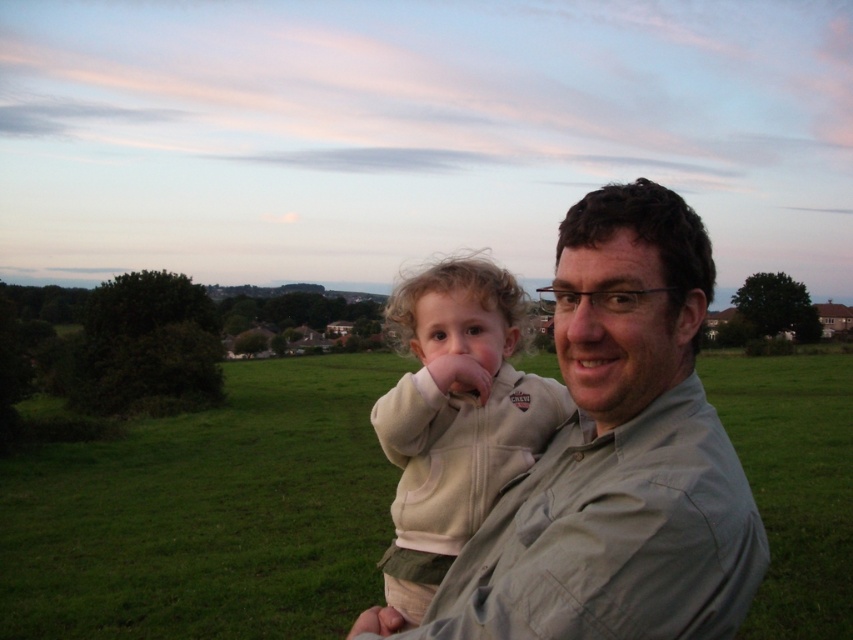
In the scene shown: Does green grass at center have a greater height compared to light gray shirt at center?

Correct, green grass at center is much taller as light gray shirt at center.

Which is more to the left, green grass at center or light gray shirt at center?

From the viewer's perspective, light gray shirt at center appears more on the left side.

Does point (772, 525) come in front of point (740, 513)?

No.

Identify the location of green grass at center. Image resolution: width=853 pixels, height=640 pixels. (207, 515).

Can you confirm if green grass at center is positioned to the right of light beige fleece at center?

Yes, green grass at center is to the right of light beige fleece at center.

Consider the image. Does green grass at center have a smaller size compared to light beige fleece at center?

No.

Locate an element on the screen. The height and width of the screenshot is (640, 853). green grass at center is located at coordinates [x=207, y=515].

Between point (651, 241) and point (473, 419), which one is positioned behind?

The point (473, 419) is more distant.

The width and height of the screenshot is (853, 640). Describe the element at coordinates (614, 458) in the screenshot. I see `light gray shirt at center` at that location.

Is point (575, 602) closer to viewer compared to point (442, 384)?

Yes.

Identify the location of light gray shirt at center. (614, 458).